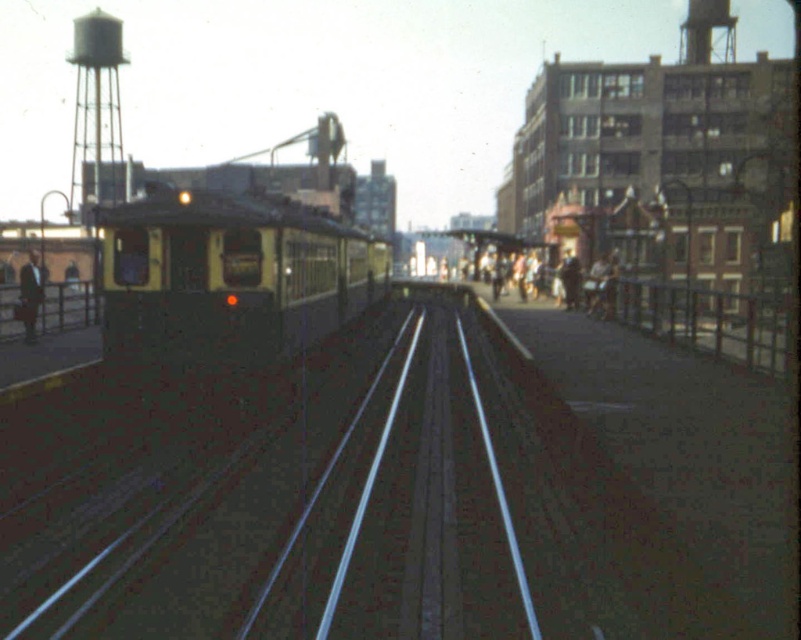
Question: Which point is farther to the camera?

Choices:
 (A) (332, 316)
 (B) (397, 620)
 (C) (121, 160)
 (D) (34, 291)

Answer: (C)

Question: Can you confirm if yellow matte train at left is wider than white painted metal water tower at upper left?

Choices:
 (A) yes
 (B) no

Answer: (B)

Question: Among these objects, which one is nearest to the camera?

Choices:
 (A) metallic silver train track at center
 (B) matte black suit at left
 (C) white painted metal water tower at upper left

Answer: (A)

Question: Which object appears closest to the camera in this image?

Choices:
 (A) metallic silver train track at center
 (B) white painted metal water tower at upper left

Answer: (A)

Question: Is yellow matte train at left positioned at the back of matte black suit at left?

Choices:
 (A) no
 (B) yes

Answer: (A)

Question: In this image, where is white painted metal water tower at upper left located relative to matte black suit at left?

Choices:
 (A) right
 (B) left

Answer: (B)